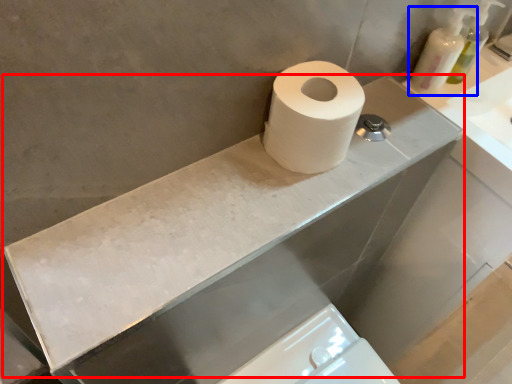
Question: Among these objects, which one is nearest to the camera, counter top (highlighted by a red box) or soap dispenser (highlighted by a blue box)?

Choices:
 (A) counter top
 (B) soap dispenser

Answer: (A)